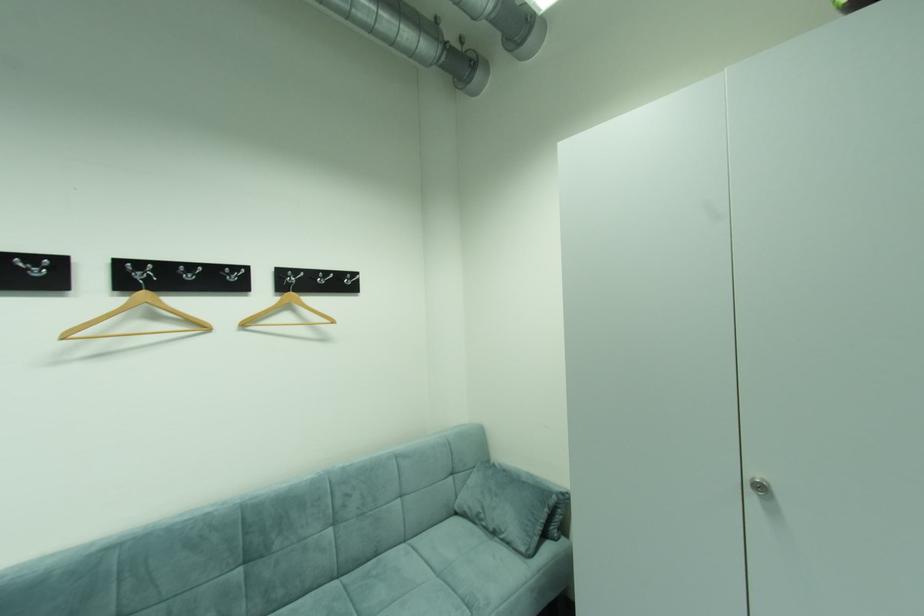
This screenshot has height=616, width=924. Identify the location of grey sofa pillow. (505, 506).